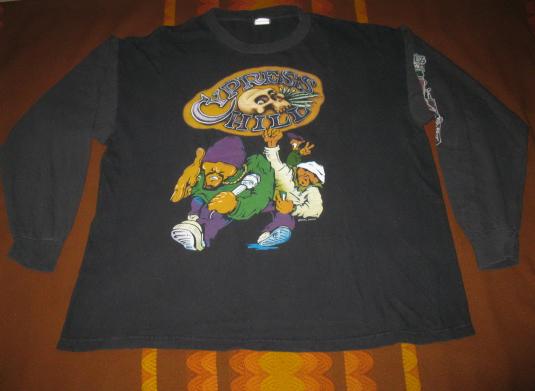
You are a GUI agent. You are given a task and a screenshot of the screen. Output one action in this format:
    pyautogui.click(x=<x>, y=<y>)
    Task: Click on the blanket
    The height and width of the screenshot is (391, 535).
    Given the screenshot: What is the action you would take?
    pyautogui.click(x=293, y=361)